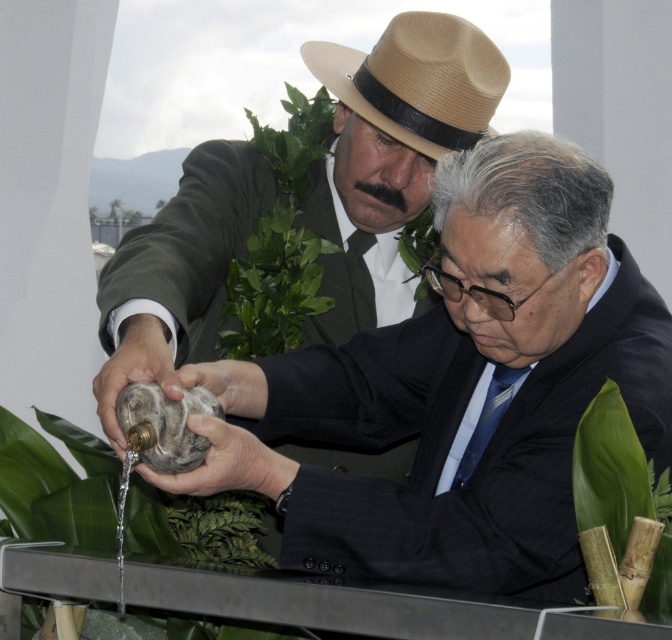
Can you confirm if matte black suit at center is thinner than tan straw fedora at upper center?

In fact, matte black suit at center might be wider than tan straw fedora at upper center.

Is matte black suit at center positioned at the back of tan straw fedora at upper center?

No, matte black suit at center is in front of tan straw fedora at upper center.

In order to click on matte black suit at center in this screenshot , I will do `click(460, 388)`.

Between tan straw fedora at upper center and green bamboo at lower right, which one is positioned higher?

tan straw fedora at upper center is higher up.

Where is `tan straw fedora at upper center`? tan straw fedora at upper center is located at coordinates (419, 81).

Is tan straw fedora at upper center to the left of green leafy plant at upper center from the viewer's perspective?

In fact, tan straw fedora at upper center is to the right of green leafy plant at upper center.

Does point (470, 112) lie behind point (319, 97)?

No, (470, 112) is in front of (319, 97).

Which is behind, point (407, 54) or point (304, 168)?

Positioned behind is point (304, 168).

The image size is (672, 640). I want to click on tan straw fedora at upper center, so click(419, 81).